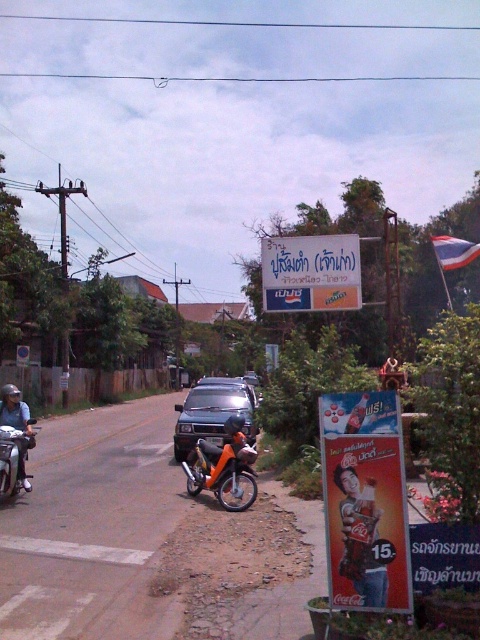
You are standing at the point with coordinates (223,467) in this rural road scene. What object is exactly at your current location?

The orange matte motorcycle at center is exactly at the point with coordinates (223,467).

You are standing at the point with coordinates point (203, 465) and want to walk to the point with coordinates point (338, 509). Which direction should you move to reach your destination?

You should move forward because point (338, 509) is in front of point (203, 465).

You are a driver trying to park your car in the rural road scene. The parking spot you want is at point 0.647, 0.444. Is the metallic gray car at center currently occupying that spot?

The metallic gray car at center is positioned exactly at point (213,413), so yes, it is occupying the parking spot you want.